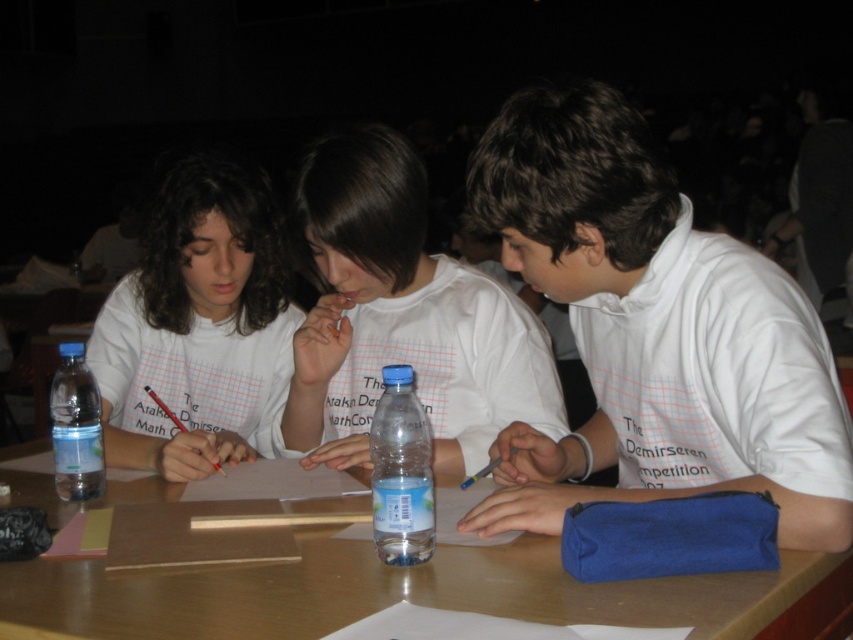
Is point (235, 604) closer to camera compared to point (77, 406)?

Yes, it is.

Image resolution: width=853 pixels, height=640 pixels. In order to click on wooden table at center in this screenshot , I will do `click(399, 593)`.

In the scene shown: Measure the distance between point (561, 253) and camera.

Point (561, 253) is 1.11 meters away from camera.

Which is more to the right, white matte shirt at center or white cotton shirt at center?

white matte shirt at center

Measure the distance between point [795,444] and camera.

The distance of point [795,444] from camera is 97.95 centimeters.

Where is `white matte shirt at center`? white matte shirt at center is located at coordinates (654, 332).

What do you see at coordinates (403, 317) in the screenshot?
I see `white cotton shirt at center` at bounding box center [403, 317].

Which is behind, point (370, 195) or point (68, 342)?

The point (370, 195) is more distant.

What are the coordinates of `white cotton shirt at center` in the screenshot? It's located at (403, 317).